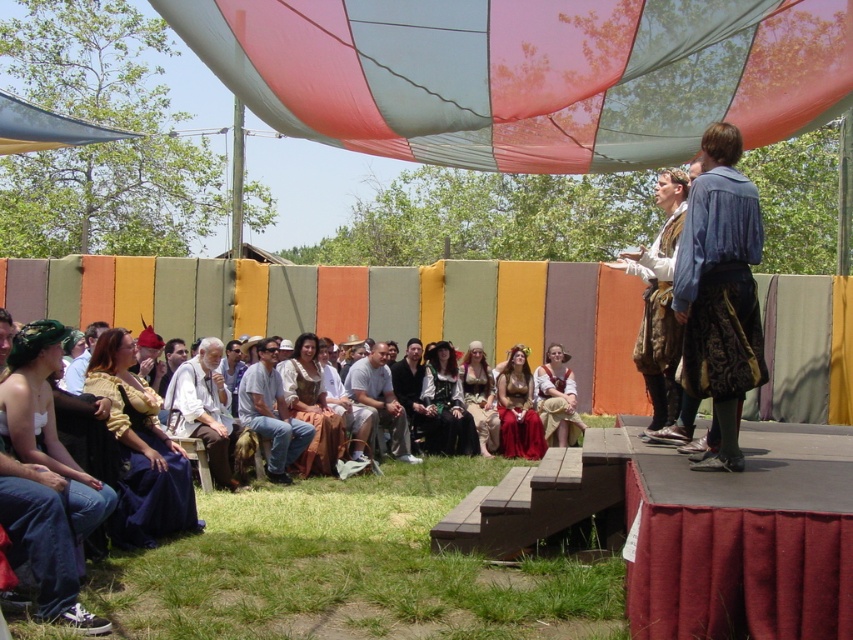
Does matte yellow dress at lower left have a lesser width compared to matte brown leather skirt at center?

In fact, matte yellow dress at lower left might be wider than matte brown leather skirt at center.

Does point (100, 368) lie in front of point (544, 422)?

Yes, point (100, 368) is closer to viewer.

Identify the location of matte yellow dress at lower left. The height and width of the screenshot is (640, 853). (140, 451).

Does matte brown leather skirt at center appear over matte brown hat at center?

No.

Does matte brown leather skirt at center appear on the right side of matte brown hat at center?

Yes, matte brown leather skirt at center is to the right of matte brown hat at center.

At what (x,y) coordinates should I click in order to perform the action: click on matte brown leather skirt at center. Please return your answer as a coordinate pair (x, y). Looking at the image, I should click on (556, 397).

This screenshot has width=853, height=640. What do you see at coordinates (416, 397) in the screenshot?
I see `matte black dress at center` at bounding box center [416, 397].

Does matte black dress at center have a smaller size compared to matte brown leather jacket at lower left?

Actually, matte black dress at center might be larger than matte brown leather jacket at lower left.

Is point (413, 422) behind point (74, 364)?

Yes, point (413, 422) is behind point (74, 364).

I want to click on matte black dress at center, so click(x=416, y=397).